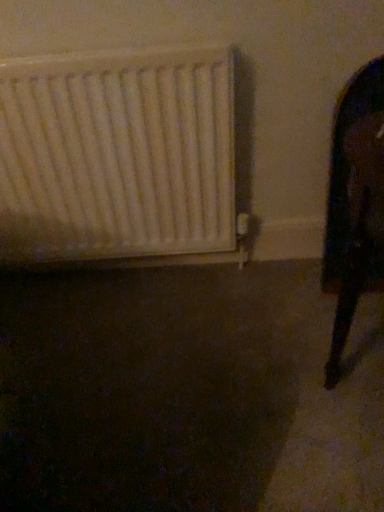
The image size is (384, 512). What do you see at coordinates (117, 156) in the screenshot?
I see `white matte radiator at left` at bounding box center [117, 156].

What is the approximate width of white matte radiator at left?

It is 4.69 inches.

Locate an element on the screen. This screenshot has width=384, height=512. white matte radiator at left is located at coordinates (117, 156).

What do you see at coordinates (355, 205) in the screenshot?
I see `black glossy mirror at right` at bounding box center [355, 205].

Find the location of `black glossy mirror at right`. black glossy mirror at right is located at coordinates (355, 205).

In order to face black glossy mirror at right, should I rotate leftwards or rightwards?

To align with it, rotate right about 23.029°.

I want to click on white matte radiator at left, so click(117, 156).

Which is more to the right, white matte radiator at left or black glossy mirror at right?

Positioned to the right is black glossy mirror at right.

Is white matte radiator at left in front of or behind black glossy mirror at right in the image?

In the image, white matte radiator at left appears behind black glossy mirror at right.

Does point (35, 134) appear closer or farther from the camera than point (333, 246)?

Point (35, 134) is closer to the camera than point (333, 246).

From the image's perspective, which one is positioned lower, white matte radiator at left or black glossy mirror at right?

black glossy mirror at right.

From a real-world perspective, is white matte radiator at left under black glossy mirror at right?

No, from a real-world perspective, white matte radiator at left is not below black glossy mirror at right.

Considering the sizes of white matte radiator at left and black glossy mirror at right in the image, is white matte radiator at left wider or thinner than black glossy mirror at right?

Considering their sizes, white matte radiator at left looks slimmer than black glossy mirror at right.

Who is taller, white matte radiator at left or black glossy mirror at right?

black glossy mirror at right.

Between white matte radiator at left and black glossy mirror at right, which one has smaller size?

black glossy mirror at right.

Could black glossy mirror at right be considered to be inside white matte radiator at left?

No, white matte radiator at left does not contain black glossy mirror at right.

Is white matte radiator at left in contact with black glossy mirror at right?

No, white matte radiator at left is not next to black glossy mirror at right.

Is white matte radiator at left positioned with its back to black glossy mirror at right?

white matte radiator at left does not have its back to black glossy mirror at right.

Locate an element on the screen. The height and width of the screenshot is (512, 384). radiator above the black glossy mirror at right (from a real-world perspective) is located at coordinates (117, 156).

Is black glossy mirror at right to the left or to the right of white matte radiator at left in the image?

In the image, black glossy mirror at right appears on the right side of white matte radiator at left.

Between black glossy mirror at right and white matte radiator at left, which one is positioned in front?

black glossy mirror at right.

Considering the positions of point (376, 281) and point (230, 78), is point (376, 281) closer or farther from the camera than point (230, 78)?

Clearly, point (376, 281) is closer to the camera than point (230, 78).

From the image's perspective, which is below, black glossy mirror at right or white matte radiator at left?

black glossy mirror at right is shown below in the image.

From a real-world perspective, is black glossy mirror at right under white matte radiator at left?

Yes.

Is black glossy mirror at right thinner than white matte radiator at left?

No.

Who is shorter, black glossy mirror at right or white matte radiator at left?

With less height is white matte radiator at left.

Based on the photo, considering the sizes of objects black glossy mirror at right and white matte radiator at left in the image provided, who is bigger, black glossy mirror at right or white matte radiator at left?

Bigger between the two is white matte radiator at left.

Is black glossy mirror at right not within white matte radiator at left?

That's correct, black glossy mirror at right is outside of white matte radiator at left.

Is the surface of black glossy mirror at right in direct contact with white matte radiator at left?

No, black glossy mirror at right is not with white matte radiator at left.

Is white matte radiator at left at the back of black glossy mirror at right?

No, white matte radiator at left is not at the back of black glossy mirror at right.

How different are the orientations of black glossy mirror at right and white matte radiator at left in degrees?

0.00102 degrees.

This screenshot has height=512, width=384. Find the location of `furniture below the white matte radiator at left (from the image's perspective)`. furniture below the white matte radiator at left (from the image's perspective) is located at coordinates (355, 205).

The width and height of the screenshot is (384, 512). I want to click on furniture located underneath the white matte radiator at left (from a real-world perspective), so click(x=355, y=205).

Where is `radiator located behind the black glossy mirror at right`? radiator located behind the black glossy mirror at right is located at coordinates (117, 156).